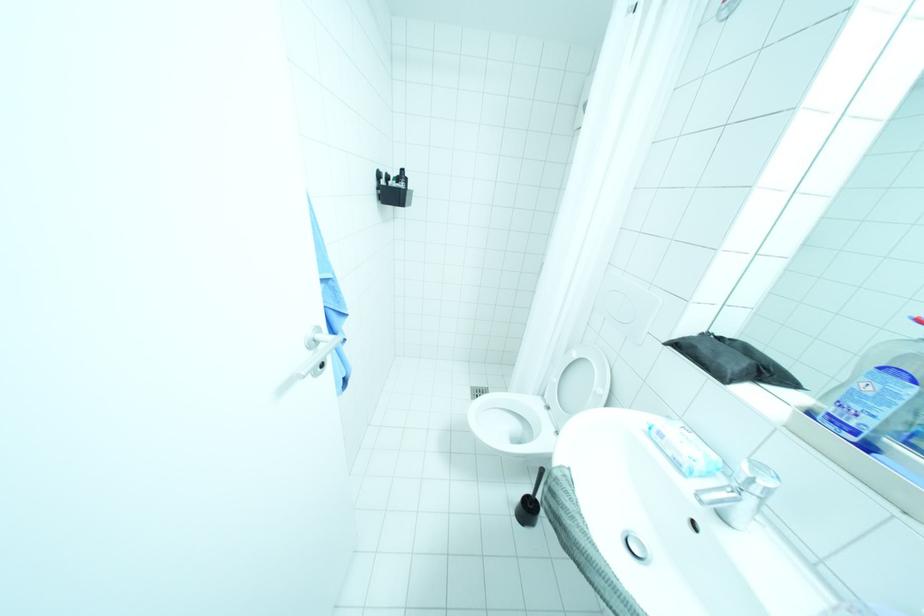
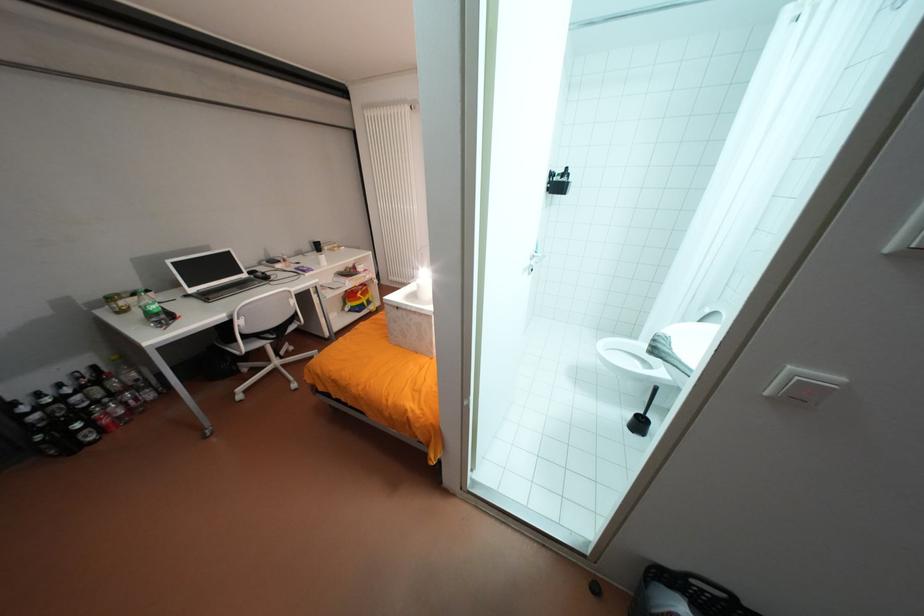
In the second image, find the point that corresponds to (576,521) in the first image.

(669, 345)